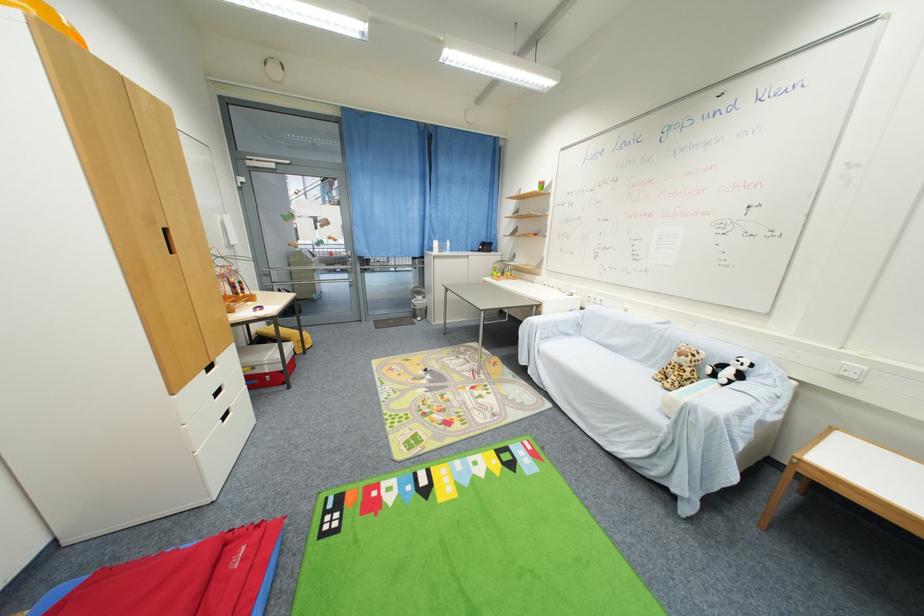
What do you see at coordinates (167, 240) in the screenshot? The image size is (924, 616). I see `the cabinet door handle` at bounding box center [167, 240].